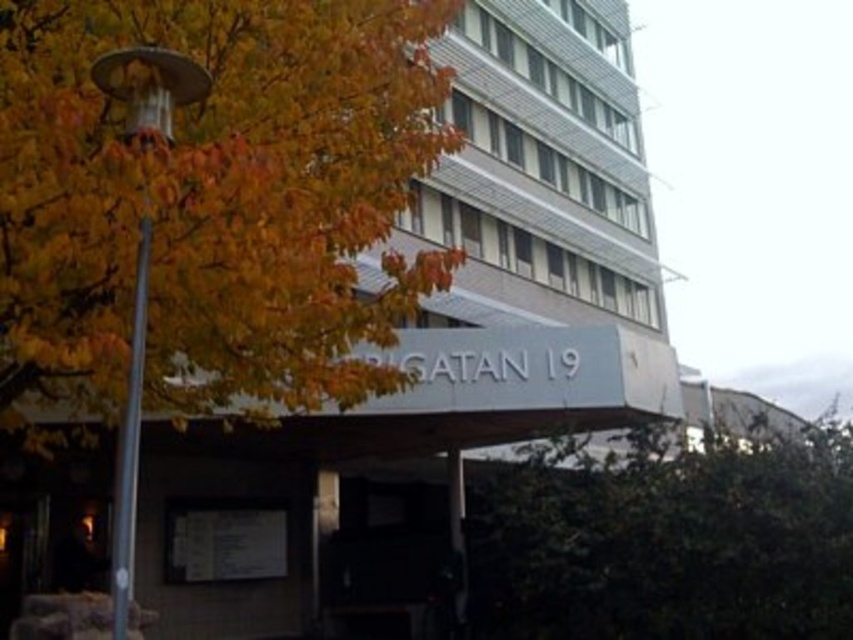
You are standing on the street looking at the building. There is a point marked at coordinates (206, 208). What object is located at that point?

The point at coordinates (206, 208) indicates the yellow leafy tree at left.

You are a painter standing in front of the building and want to capture the scene. Which object, the yellow leafy tree at left or the metallic pole at left, would you need to look up more to paint accurately?

The yellow leafy tree at left has a greater height compared to the metallic pole at left, so you would need to look up more to paint the yellow leafy tree at left accurately.